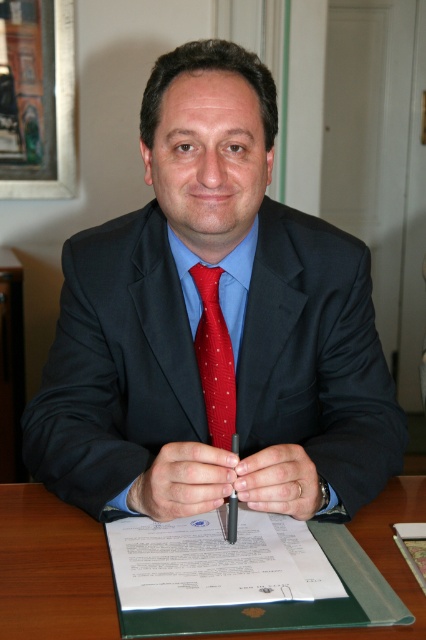
You are an office assistant who needs to place a new document on the desk. The desk has limited space, and you must ensure that the white paper at center and the red dotted fabric tie at center are both visible. Which object should you move to accommodate the new document?

The red dotted fabric tie at center should be moved because the white paper at center is larger and likely occupies more space, making it harder to move without folding or damaging it.

Consider the image. You are an office assistant who needs to hand the metallic red pen at center to the man. Since the red dotted fabric tie at center is in the way, can you move the pen without disturbing the tie?

The red dotted fabric tie at center is located above the metallic red pen at center, so you can move the pen without disturbing the tie by accessing it from below.

Where is the matte black suit at center located in terms of coordinates?

The matte black suit at center is located at coordinates point [213,326].